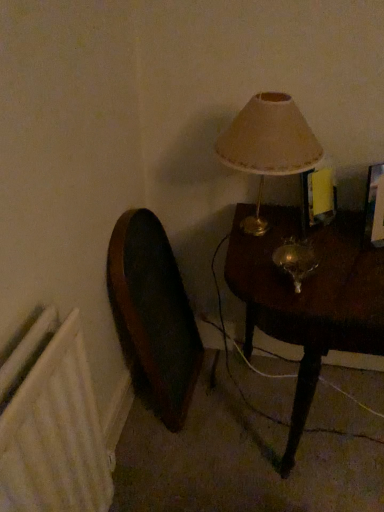
Question: Is mahogany wood table at right closer to the viewer compared to wooden swivel chair at left?

Choices:
 (A) no
 (B) yes

Answer: (B)

Question: From a real-world perspective, is mahogany wood table at right located higher than wooden swivel chair at left?

Choices:
 (A) yes
 (B) no

Answer: (B)

Question: Is mahogany wood table at right positioned far away from wooden swivel chair at left?

Choices:
 (A) no
 (B) yes

Answer: (A)

Question: Can you confirm if mahogany wood table at right is thinner than wooden swivel chair at left?

Choices:
 (A) yes
 (B) no

Answer: (B)

Question: Does mahogany wood table at right lie behind wooden swivel chair at left?

Choices:
 (A) yes
 (B) no

Answer: (B)

Question: Could you tell me if mahogany wood table at right is turned towards wooden swivel chair at left?

Choices:
 (A) yes
 (B) no

Answer: (B)

Question: Does white textured radiator at lower left have a greater width compared to mahogany wood table at right?

Choices:
 (A) no
 (B) yes

Answer: (A)

Question: Is mahogany wood table at right at the back of white textured radiator at lower left?

Choices:
 (A) no
 (B) yes

Answer: (A)

Question: From the image's perspective, is white textured radiator at lower left below mahogany wood table at right?

Choices:
 (A) no
 (B) yes

Answer: (B)

Question: Could you tell me if white textured radiator at lower left is turned towards mahogany wood table at right?

Choices:
 (A) yes
 (B) no

Answer: (B)

Question: Is the depth of white textured radiator at lower left less than that of mahogany wood table at right?

Choices:
 (A) yes
 (B) no

Answer: (A)

Question: From the image's perspective, is white textured radiator at lower left on top of mahogany wood table at right?

Choices:
 (A) yes
 (B) no

Answer: (B)

Question: Does white textured radiator at lower left have a greater width compared to wooden swivel chair at left?

Choices:
 (A) yes
 (B) no

Answer: (B)